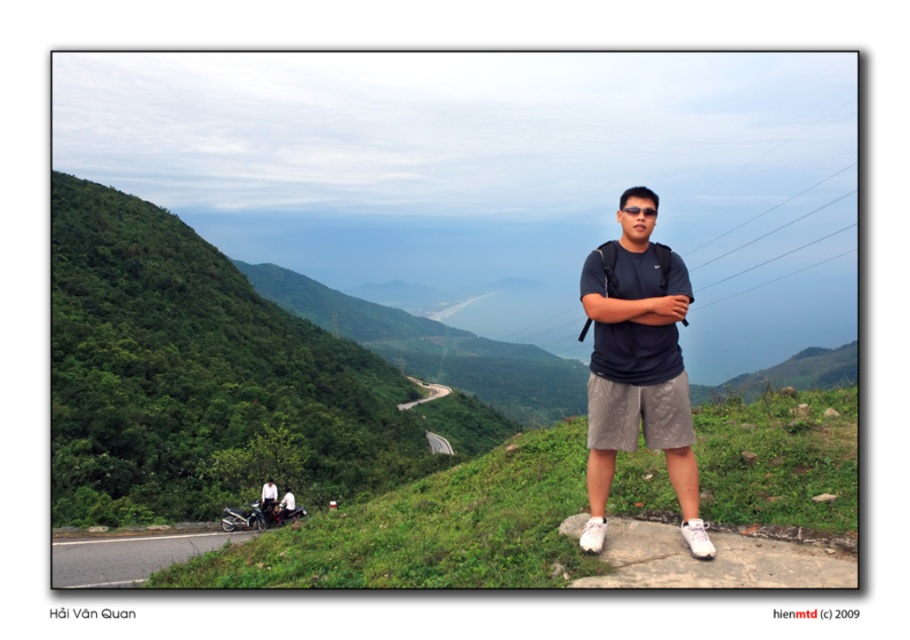
Question: Can you confirm if matte black t-shirt at center is thinner than white cotton shirt at lower left?

Choices:
 (A) yes
 (B) no

Answer: (A)

Question: Does matte black t-shirt at center lie behind white cotton shirt at lower left?

Choices:
 (A) no
 (B) yes

Answer: (A)

Question: Does matte black t-shirt at center appear on the left side of white cotton shirt at lower left?

Choices:
 (A) yes
 (B) no

Answer: (B)